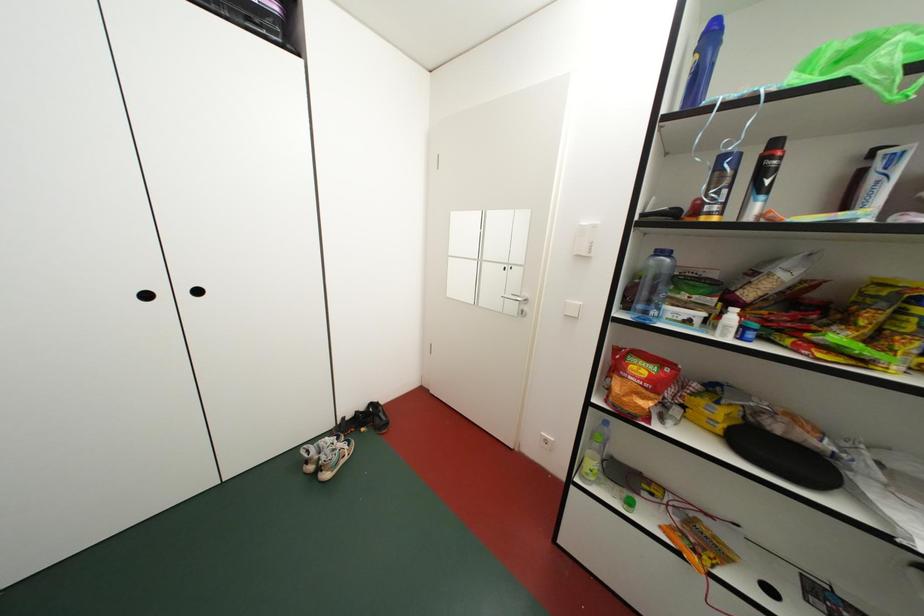
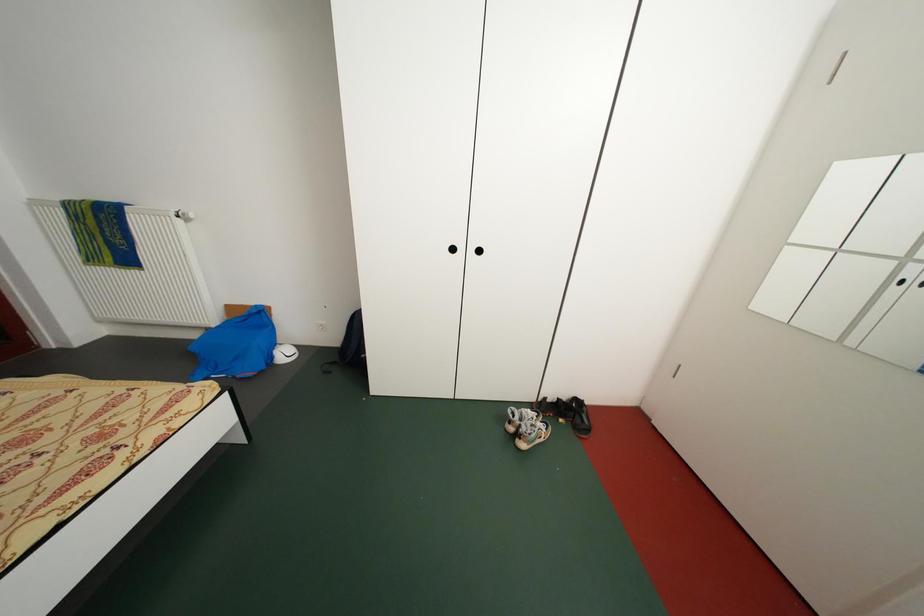
Question: The camera is either moving clockwise (left) or counter-clockwise (right) around the object. The first image is from the beginning of the video and the second image is from the end. Is the camera moving left or right when shooting the video?

Choices:
 (A) Left
 (B) Right

Answer: (B)